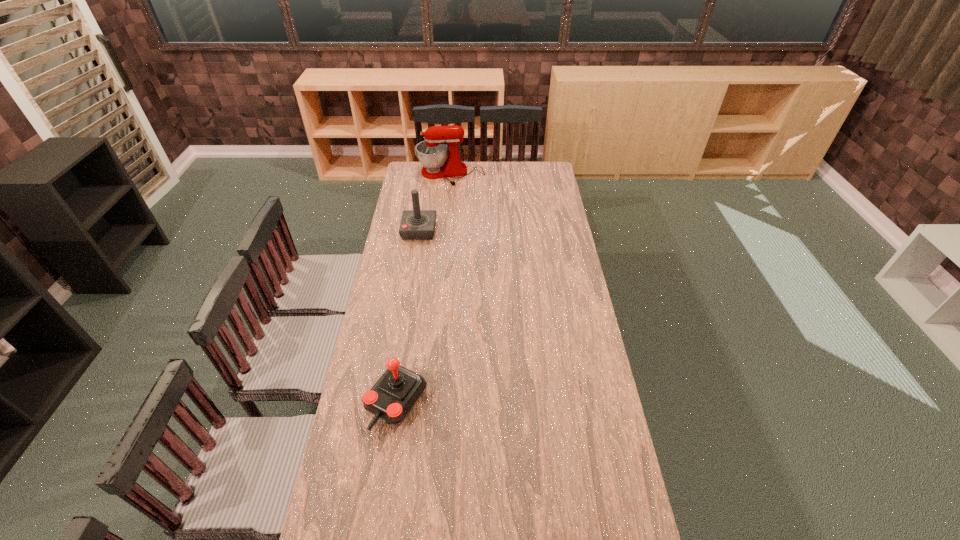
Select which object is the second closest to the farthest object. Please provide its 2D coordinates. Your answer should be formatted as a tuple, i.e. [(x, y)], where the tuple contains the x and y coordinates of a point satisfying the conditions above.

[(397, 391)]

This screenshot has width=960, height=540. In order to click on object identified as the closest to the mixer in this screenshot , I will do (416, 224).

Identify which joystick is located as the second nearest to the mixer. Please provide its 2D coordinates. Your answer should be formatted as a tuple, i.e. [(x, y)], where the tuple contains the x and y coordinates of a point satisfying the conditions above.

[(397, 391)]

Where is `free space that satisfies the following two spatial constraints: 1. on the rectangular base of the farther joystick; 2. on the left side of the nearest object`? free space that satisfies the following two spatial constraints: 1. on the rectangular base of the farther joystick; 2. on the left side of the nearest object is located at coordinates (392, 403).

Identify the location of vacant region that satisfies the following two spatial constraints: 1. on the rectangular base of the second nearest object; 2. on the right side of the nearer joystick. (392, 403).

At what (x,y) coordinates should I click in order to perform the action: click on vacant space that satisfies the following two spatial constraints: 1. on the bowl side of the mixer; 2. on the rectangular base of the farther joystick. Please return your answer as a coordinate pair (x, y). The height and width of the screenshot is (540, 960). Looking at the image, I should click on (445, 230).